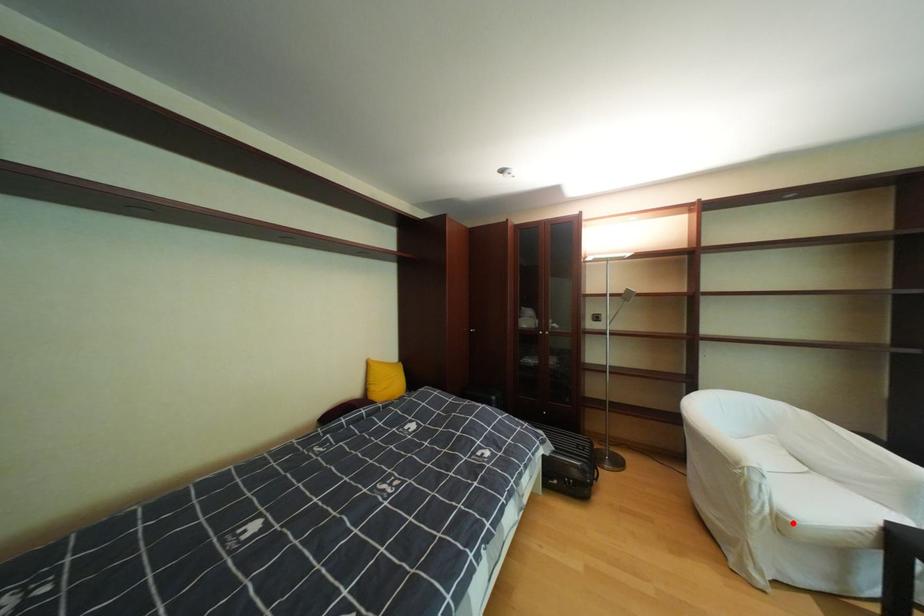
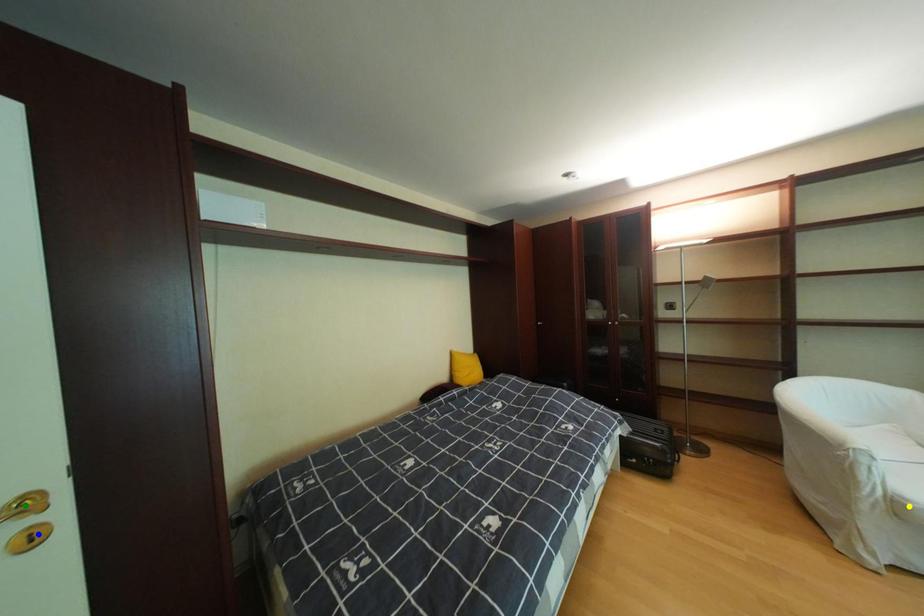
Question: I am providing you with two images of the same scene from different viewpoints. A red point is marked on the first image. You are given multiple points on the second image. Can you choose the point in image 2 that corresponds to the point in image 1?

Choices:
 (A) green point
 (B) blue point
 (C) yellow point

Answer: (C)